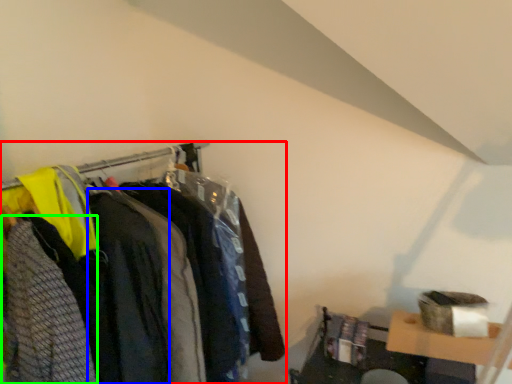
Question: Considering the real-world distances, which object is farthest from closet (highlighted by a red box)? clothing (highlighted by a blue box) or clothing (highlighted by a green box)?

Choices:
 (A) clothing
 (B) clothing

Answer: (B)